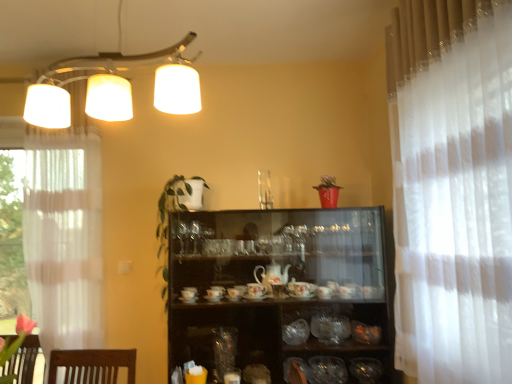
Question: Is white sheer curtain at right spatially inside transparent glass vase at center, the fifth tableware in the right-to-left sequence, or outside of it?

Choices:
 (A) outside
 (B) inside

Answer: (A)

Question: Is point (487, 18) closer or farther from the camera than point (304, 322)?

Choices:
 (A) closer
 (B) farther

Answer: (A)

Question: Which of these objects is positioned farthest from the translucent glass bowls at center, the third tableware from the right?

Choices:
 (A) transparent glass vase at center, the first tableware viewed from the left
 (B) translucent glass bowl at lower right, the 5th tableware from the left
 (C) white sheer curtain at right
 (D) metallic chrome lamp at upper left
 (E) shiny metallic bowl at lower right, which ranks as the 2th tableware in right-to-left order

Answer: (D)

Question: Considering the real-world distances, which object is farthest from the white sheer curtain at right?

Choices:
 (A) transparent glass vase at center, the fifth tableware in the right-to-left sequence
 (B) green leafy plant at center
 (C) transparent glass bowl at center, arranged as the 2th tableware when viewed from the left
 (D) shiny metallic bowl at lower right, which ranks as the 2th tableware in right-to-left order
 (E) metallic chrome lamp at upper left

Answer: (E)